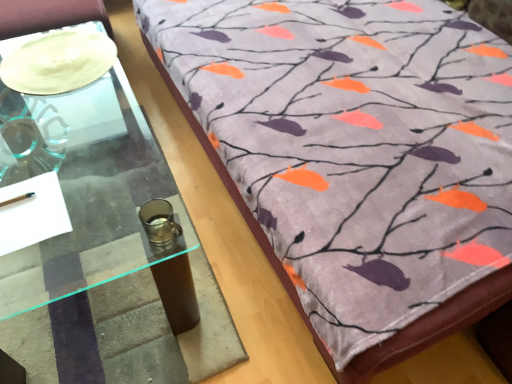
Question: Should I look upward or downward to see clear glass table at left?

Choices:
 (A) up
 (B) down

Answer: (B)

Question: From the image's perspective, does white matte plate at upper left appear lower than velvet fabric bedspread at upper right?

Choices:
 (A) no
 (B) yes

Answer: (A)

Question: Is white matte plate at upper left at the right side of velvet fabric bedspread at upper right?

Choices:
 (A) yes
 (B) no

Answer: (B)

Question: Can you confirm if white matte plate at upper left is smaller than velvet fabric bedspread at upper right?

Choices:
 (A) no
 (B) yes

Answer: (B)

Question: Considering the relative sizes of white matte plate at upper left and velvet fabric bedspread at upper right in the image provided, is white matte plate at upper left thinner than velvet fabric bedspread at upper right?

Choices:
 (A) yes
 (B) no

Answer: (A)

Question: Considering the relative positions of white matte plate at upper left and velvet fabric bedspread at upper right in the image provided, is white matte plate at upper left to the left of velvet fabric bedspread at upper right from the viewer's perspective?

Choices:
 (A) no
 (B) yes

Answer: (B)

Question: Could you tell me if white matte plate at upper left is facing velvet fabric bedspread at upper right?

Choices:
 (A) no
 (B) yes

Answer: (A)

Question: Is velvet fabric bedspread at upper right to the left of clear glass table at left from the viewer's perspective?

Choices:
 (A) yes
 (B) no

Answer: (B)

Question: Is velvet fabric bedspread at upper right completely or partially outside of clear glass table at left?

Choices:
 (A) no
 (B) yes

Answer: (B)

Question: Is velvet fabric bedspread at upper right wider than clear glass table at left?

Choices:
 (A) yes
 (B) no

Answer: (A)

Question: Is velvet fabric bedspread at upper right aimed at clear glass table at left?

Choices:
 (A) yes
 (B) no

Answer: (B)

Question: From the image's perspective, is velvet fabric bedspread at upper right over clear glass table at left?

Choices:
 (A) no
 (B) yes

Answer: (B)

Question: Does velvet fabric bedspread at upper right lie in front of clear glass table at left?

Choices:
 (A) no
 (B) yes

Answer: (B)

Question: From a real-world perspective, is white matte plate at upper left physically below clear glass table at left?

Choices:
 (A) yes
 (B) no

Answer: (B)